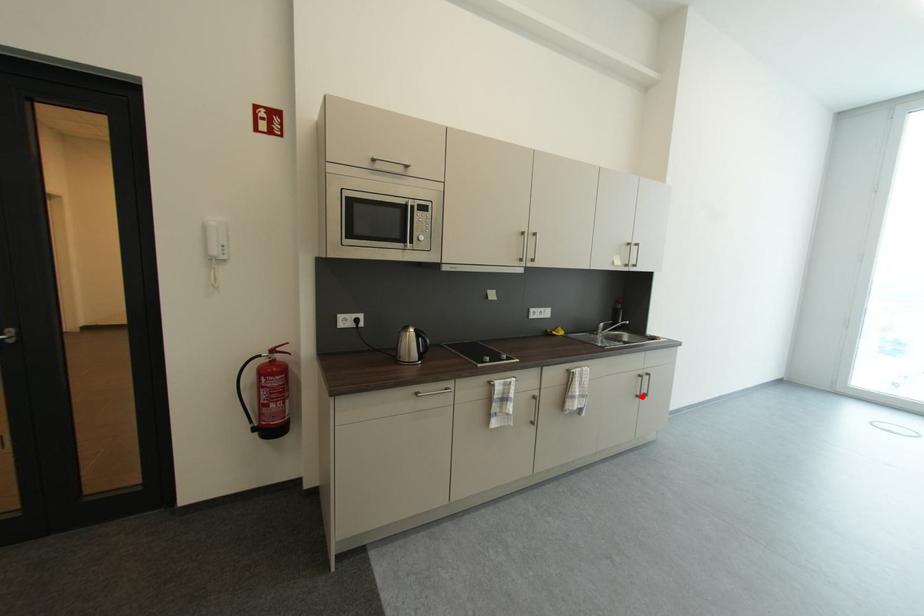
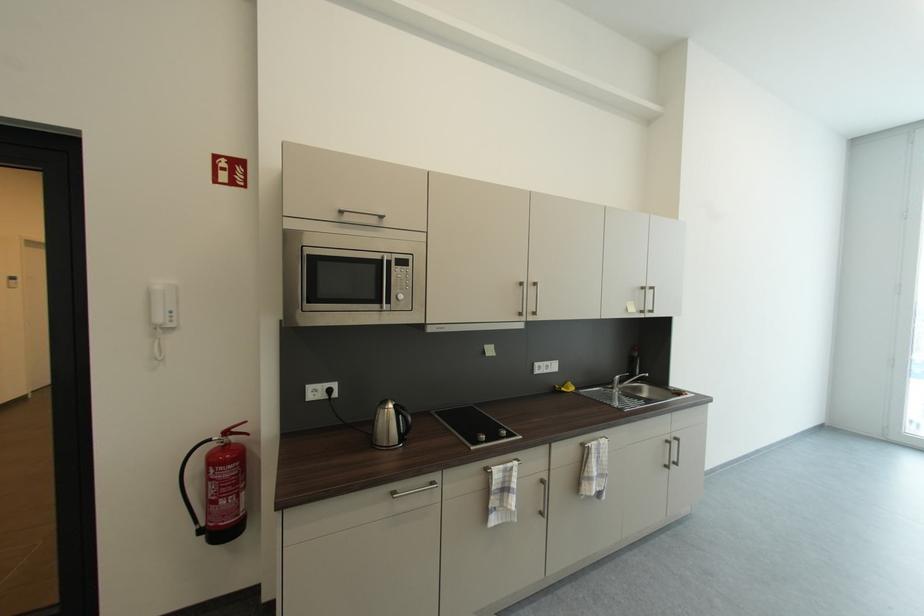
In the second image, find the point that corresponds to the highlighted location in the first image.

(670, 466)